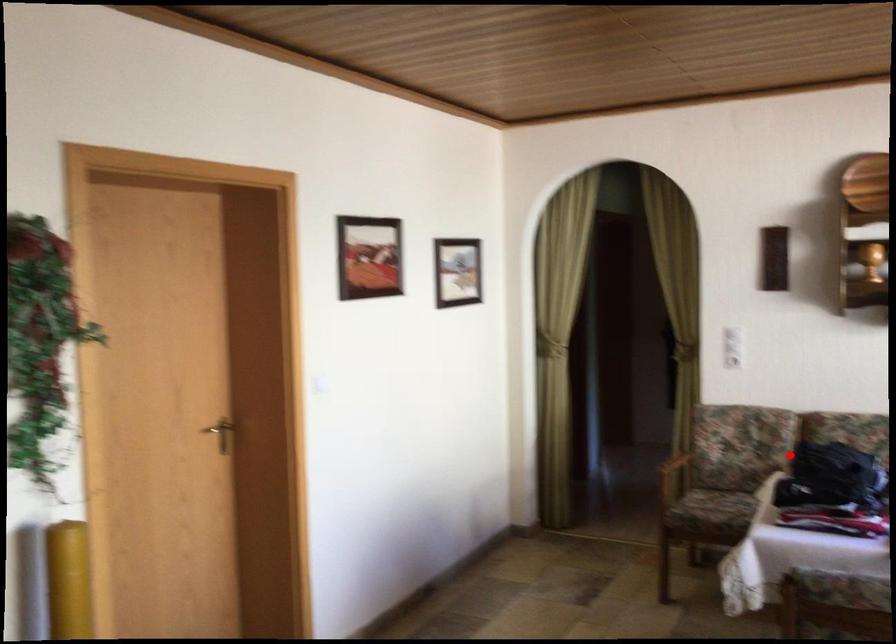
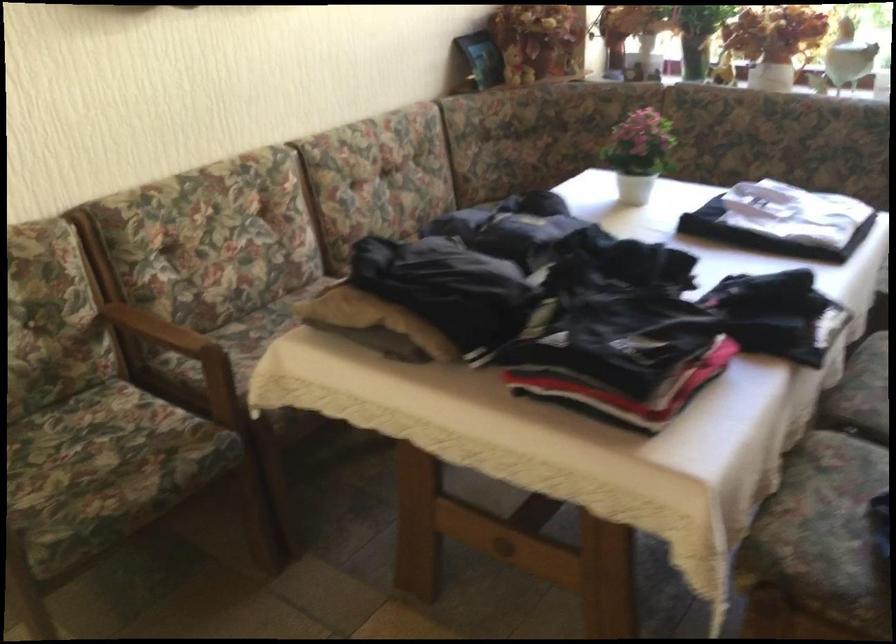
Question: I am providing you with two images of the same scene from different viewpoints. Image1 has a red point marked. In image2, the corresponding 3D location appears at what relative position? Reply with the corresponding letter.

Choices:
 (A) Closer
 (B) Farther

Answer: (A)